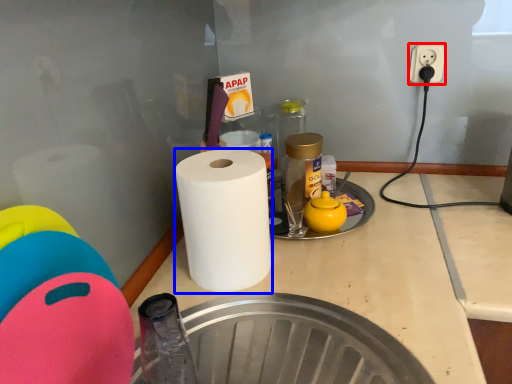
Question: Which object appears farthest to the camera in this image, electric outlet (highlighted by a red box) or paper towel (highlighted by a blue box)?

Choices:
 (A) electric outlet
 (B) paper towel

Answer: (A)